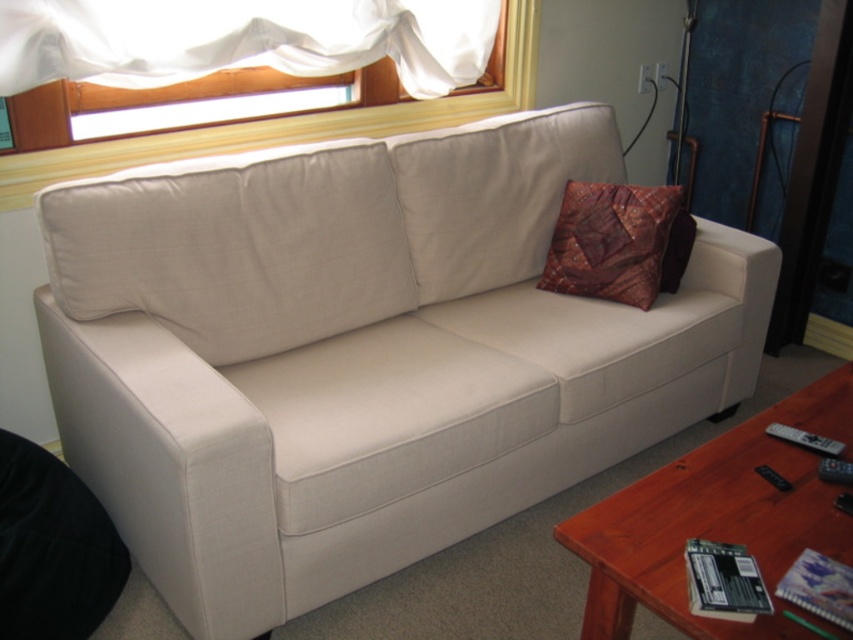
Which is behind, point (552, 177) or point (757, 568)?

The point (552, 177) is behind.

Image resolution: width=853 pixels, height=640 pixels. Find the location of `beige fabric couch at center`. beige fabric couch at center is located at coordinates (361, 353).

Who is more distant from viewer, (161, 241) or (686, 550)?

Positioned behind is point (161, 241).

In order to click on beige fabric couch at center in this screenshot , I will do `click(361, 353)`.

Can you confirm if brown wood coffee table at lower right is wider than white sheer curtain at upper left?

No, brown wood coffee table at lower right is not wider than white sheer curtain at upper left.

Between brown wood coffee table at lower right and white sheer curtain at upper left, which one appears on the left side from the viewer's perspective?

Positioned to the left is white sheer curtain at upper left.

Does point (601, 608) come in front of point (245, 61)?

Yes, it is.

Where is `brown wood coffee table at lower right`? brown wood coffee table at lower right is located at coordinates (717, 520).

Can you confirm if brown wood coffee table at lower right is positioned above black matte card at lower right?

Correct, brown wood coffee table at lower right is located above black matte card at lower right.

Between brown wood coffee table at lower right and black matte card at lower right, which one has more height?

With more height is brown wood coffee table at lower right.

Does point (660, 564) lie behind point (734, 552)?

No, (660, 564) is in front of (734, 552).

You are a GUI agent. You are given a task and a screenshot of the screen. Output one action in this format:
    pyautogui.click(x=<x>, y=<y>)
    Task: Click on the brown wood coffee table at lower right
    
    Given the screenshot: What is the action you would take?
    pyautogui.click(x=717, y=520)